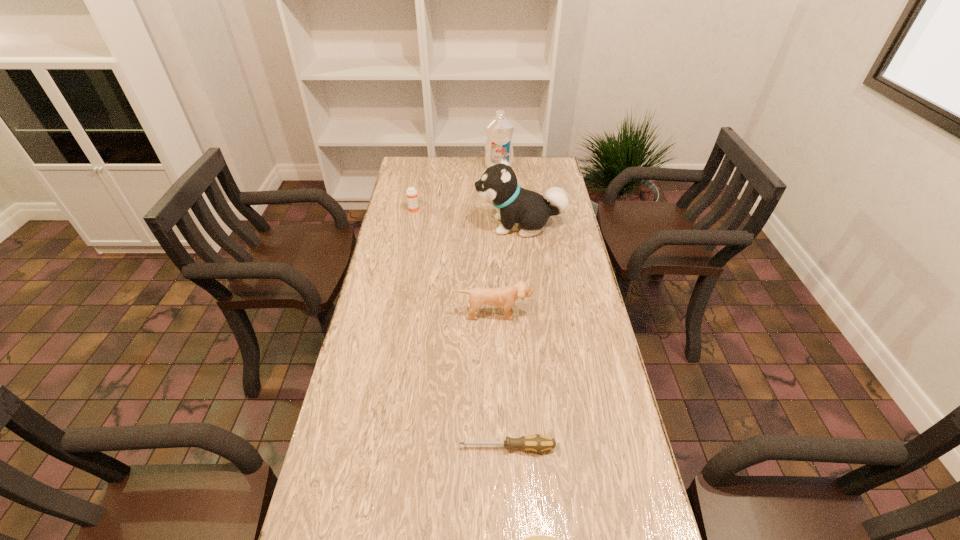
Find the location of a particular element. Image resolution: width=960 pixels, height=540 pixels. the fifth closest object to the farther puppy is located at coordinates (534, 539).